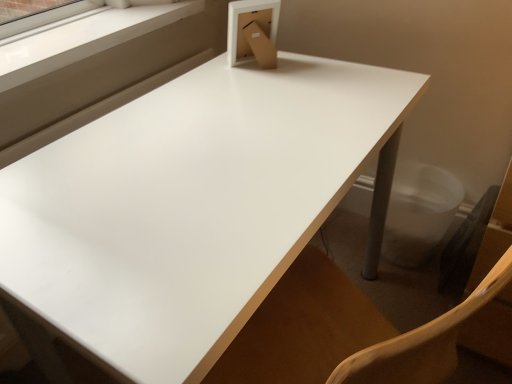
Question: Is white glossy table at center spatially inside white plastic window frame at upper left, or outside of it?

Choices:
 (A) outside
 (B) inside

Answer: (A)

Question: From a real-world perspective, is white glossy table at center positioned above or below white plastic window frame at upper left?

Choices:
 (A) above
 (B) below

Answer: (B)

Question: From the image's perspective, is white glossy table at center positioned above or below white plastic window frame at upper left?

Choices:
 (A) below
 (B) above

Answer: (A)

Question: In the image, is white plastic window frame at upper left positioned in front of or behind white glossy table at center?

Choices:
 (A) front
 (B) behind

Answer: (B)

Question: Looking at their shapes, would you say white plastic window frame at upper left is wider or thinner than white glossy table at center?

Choices:
 (A) thin
 (B) wide

Answer: (A)

Question: From the image's perspective, relative to white glossy table at center, is white plastic window frame at upper left above or below?

Choices:
 (A) below
 (B) above

Answer: (B)

Question: Considering the positions of white plastic window frame at upper left and white glossy table at center in the image, is white plastic window frame at upper left taller or shorter than white glossy table at center?

Choices:
 (A) short
 (B) tall

Answer: (A)